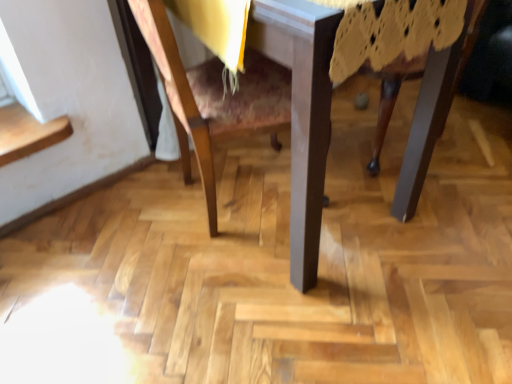
I want to click on free space in front of wooden chair at center, so click(231, 306).